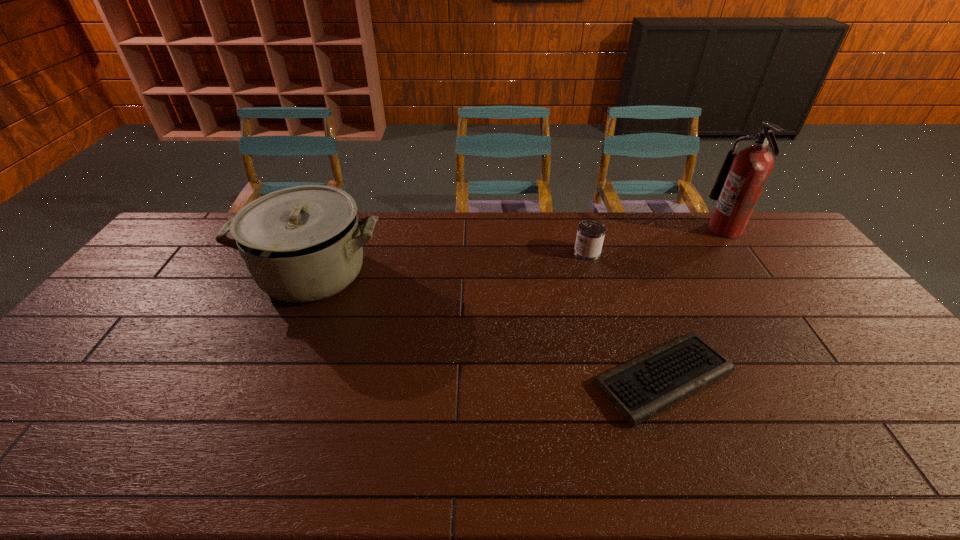
This screenshot has width=960, height=540. Identify the location of vacant space at the right edge of the desktop. (889, 374).

I want to click on free space at the far left corner, so click(x=177, y=236).

In the image, there is a desktop. Find the location of `free space at the far right corner`. free space at the far right corner is located at coordinates (759, 217).

Identify the location of empty location between the saucepan and the computer keyboard. (488, 326).

Identify the location of free point between the nearest object and the rightmost object. (x=694, y=303).

The height and width of the screenshot is (540, 960). I want to click on vacant space that is in between the leftmost object and the rightmost object, so click(519, 252).

Locate an element on the screen. This screenshot has width=960, height=540. vacant area that lies between the tallest object and the second tallest object is located at coordinates (519, 252).

The image size is (960, 540). In order to click on vacant area that lies between the nearest object and the second shortest object in this screenshot , I will do `click(625, 315)`.

This screenshot has width=960, height=540. In order to click on vacant region between the second tallest object and the shortest object in this screenshot , I will do `click(488, 326)`.

The image size is (960, 540). In order to click on free area in between the can and the third shortest object in this screenshot , I will do `click(450, 264)`.